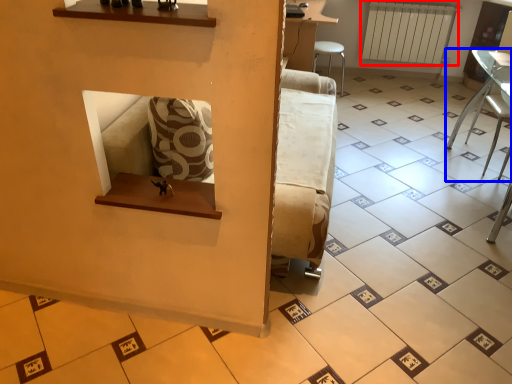
Question: Which point is closer to the camera, radiator (highlighted by a red box) or furniture (highlighted by a blue box)?

Choices:
 (A) radiator
 (B) furniture

Answer: (B)